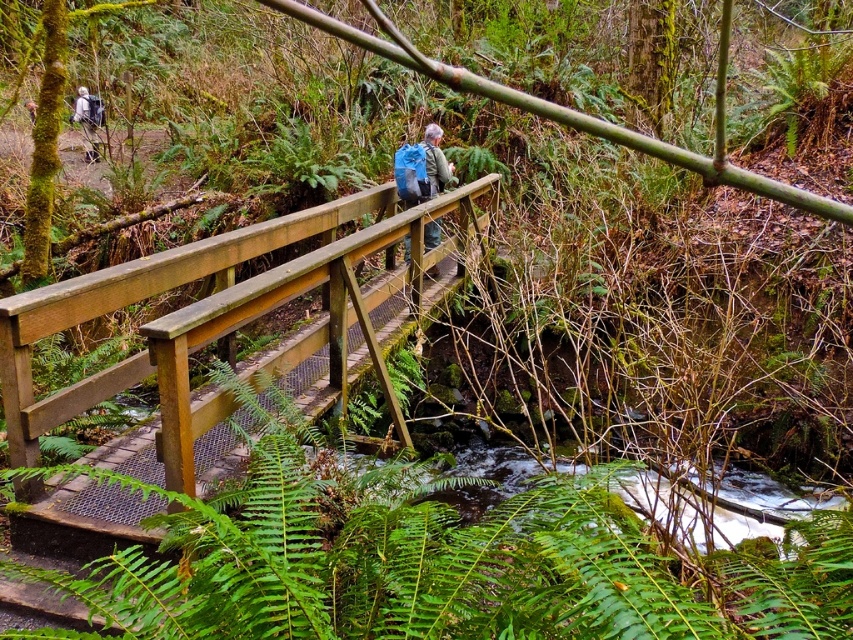
Who is taller, green leafy fern at center or blue backpack at center?

blue backpack at center is taller.

Can you confirm if green leafy fern at center is taller than blue backpack at center?

No, green leafy fern at center is not taller than blue backpack at center.

This screenshot has height=640, width=853. Describe the element at coordinates (450, 566) in the screenshot. I see `green leafy fern at center` at that location.

At what (x,y) coordinates should I click in order to perform the action: click on green leafy fern at center. Please return your answer as a coordinate pair (x, y). This screenshot has width=853, height=640. Looking at the image, I should click on (450, 566).

Can you confirm if wooden rail at center is positioned below blue backpack at center?

Yes.

Find the location of a particular element. wooden rail at center is located at coordinates (221, 320).

Is green leafy fern at center taller than wooden rail at center?

No, green leafy fern at center is not taller than wooden rail at center.

This screenshot has height=640, width=853. What do you see at coordinates (450, 566) in the screenshot?
I see `green leafy fern at center` at bounding box center [450, 566].

Is point (612, 500) more distant than point (22, 490)?

No, (612, 500) is in front of (22, 490).

Locate an element on the screen. The image size is (853, 640). green leafy fern at center is located at coordinates (450, 566).